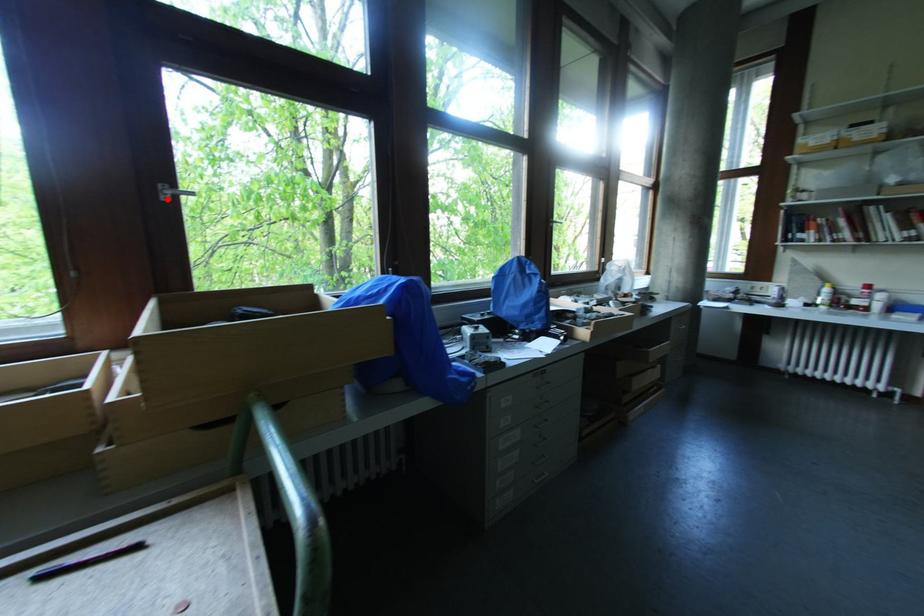
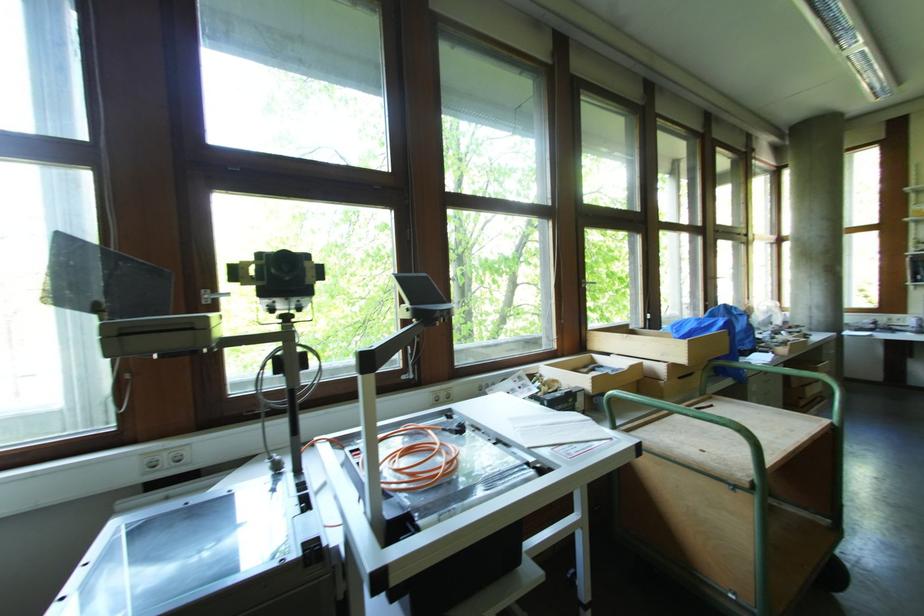
The point at the highlighted location is marked in the first image. Where is the corresponding point in the second image?

(586, 286)